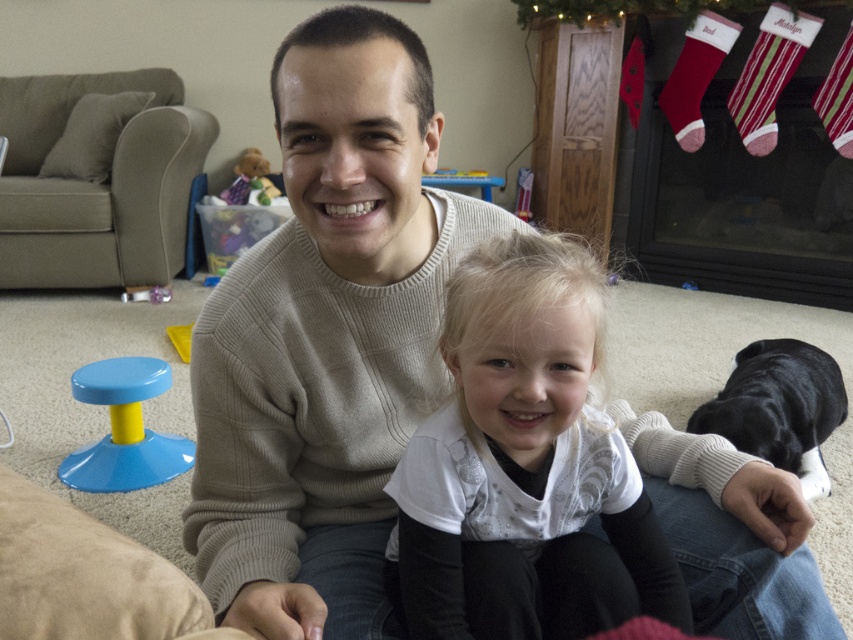
Does black smooth dog at lower right have a greater width compared to fuzzy fabric teddy bear at upper left?

Yes, black smooth dog at lower right is wider than fuzzy fabric teddy bear at upper left.

Which is above, black smooth dog at lower right or fuzzy fabric teddy bear at upper left?

fuzzy fabric teddy bear at upper left is higher up.

Who is more distant from viewer, (712,417) or (239,164)?

The point (239,164) is behind.

You are a GUI agent. You are given a task and a screenshot of the screen. Output one action in this format:
    pyautogui.click(x=<x>, y=<y>)
    Task: Click on the black smooth dog at lower right
    The image size is (853, 640).
    Given the screenshot: What is the action you would take?
    pyautogui.click(x=779, y=406)

Which is below, white matte shirt at center or blue plastic stool at lower left?

blue plastic stool at lower left is below.

Is white matte shirt at center above blue plastic stool at lower left?

Yes.

What do you see at coordinates (525, 467) in the screenshot? I see `white matte shirt at center` at bounding box center [525, 467].

The image size is (853, 640). I want to click on white matte shirt at center, so click(525, 467).

At what (x,y) coordinates should I click in order to perform the action: click on velvet red stocking at upper right. Please return your answer as a coordinate pair (x, y). The height and width of the screenshot is (640, 853). Looking at the image, I should click on (695, 76).